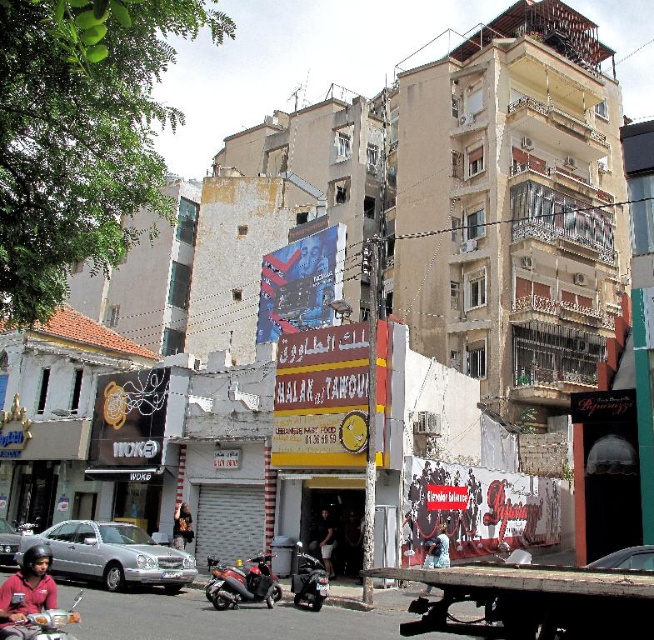
You are a tourist trying to locate the shiny metallic scooter at lower center and the blue denim jacket at lower center in the scene. From the perspective of someone facing the street, which object is positioned to the left?

The shiny metallic scooter at lower center is to the left of the blue denim jacket at lower center, so from the perspective of someone facing the street, the shiny metallic scooter at lower center is positioned to the left.

You are a delivery rider who just arrived at the Halak al Tawouk restaurant. You see the matte black helmet at lower left and the shiny black motorcycle at center. Which object is closer to the restaurant entrance?

The matte black helmet at lower left is closer to the restaurant entrance because it is positioned to the left of the shiny black motorcycle at center, which is further away from the entrance.